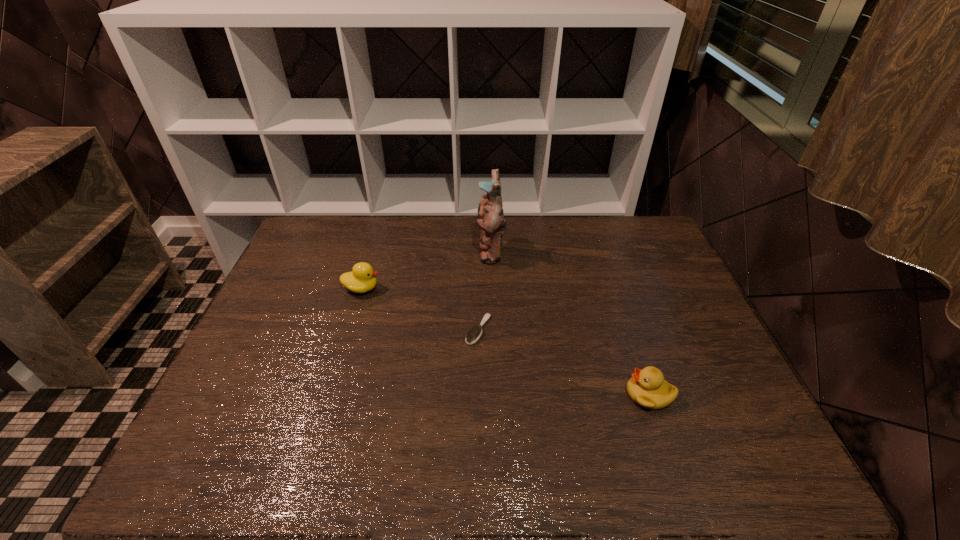
I want to click on unoccupied position between the farther duckling and the rightmost object, so click(x=506, y=341).

Identify the location of vacant area that lies between the leftmost object and the scrubbing brush. The image size is (960, 540). (420, 309).

Select which object appears as the closest to the tallest object. Please provide its 2D coordinates. Your answer should be formatted as a tuple, i.e. [(x, y)], where the tuple contains the x and y coordinates of a point satisfying the conditions above.

[(473, 335)]

This screenshot has width=960, height=540. I want to click on the second closest object to the right duckling, so click(x=490, y=218).

I want to click on blank space that satisfies the following two spatial constraints: 1. on the beak of the left duckling; 2. on the back side of the scrubbing brush, so click(349, 330).

This screenshot has width=960, height=540. Find the location of `vacant point that satisfies the following two spatial constraints: 1. on the beak of the third nearest object; 2. on the right side of the second nearest object`. vacant point that satisfies the following two spatial constraints: 1. on the beak of the third nearest object; 2. on the right side of the second nearest object is located at coordinates (349, 330).